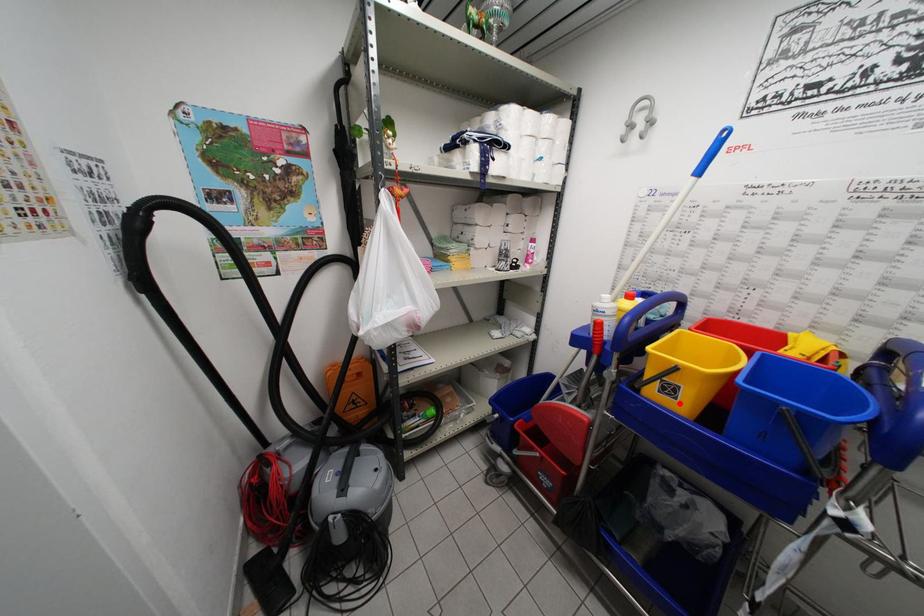
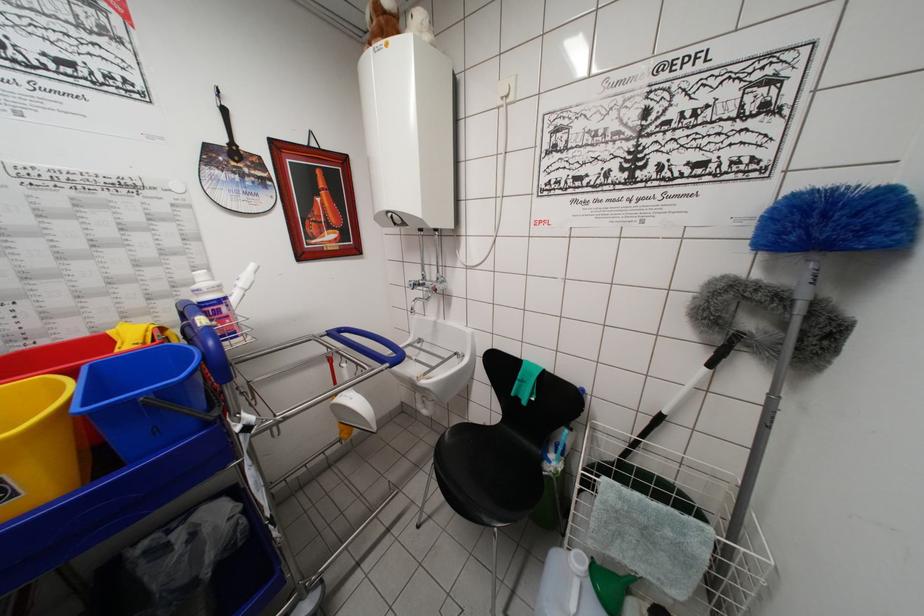
Locate, in the second image, the point that corresponds to the highlighted location in the first image.

(20, 500)